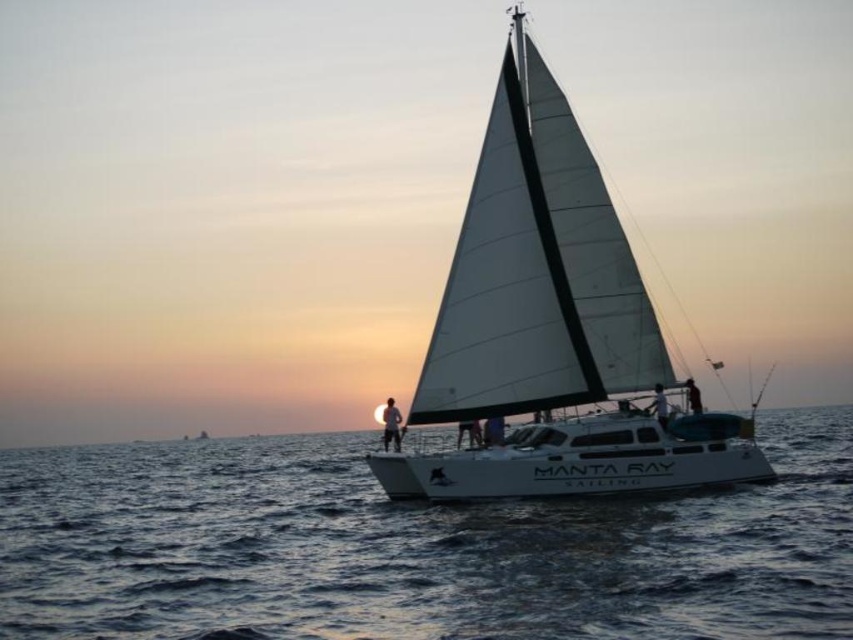
You are a photographer trying to capture the sailboat named Manta Ray Sailing. You want to focus on both point (762, 616) and point (483, 385). Which point should you adjust your camera to focus on first if you want to ensure the closer point is in sharp focus?

Point (762, 616) is closer to the camera than point (483, 385), so you should focus on point (762, 616) first to ensure it is in sharp focus.

You are standing on the deck of the sailboat named Manta Ray Sailing and looking at two points on the boat. The first point is at coordinates point (x=599, y=214) and the second point is at point (x=653, y=404). Which point is closer to you?

Point (x=599, y=214) is further to the viewer than point (x=653, y=404), so the point closer to you is point (x=653, y=404).